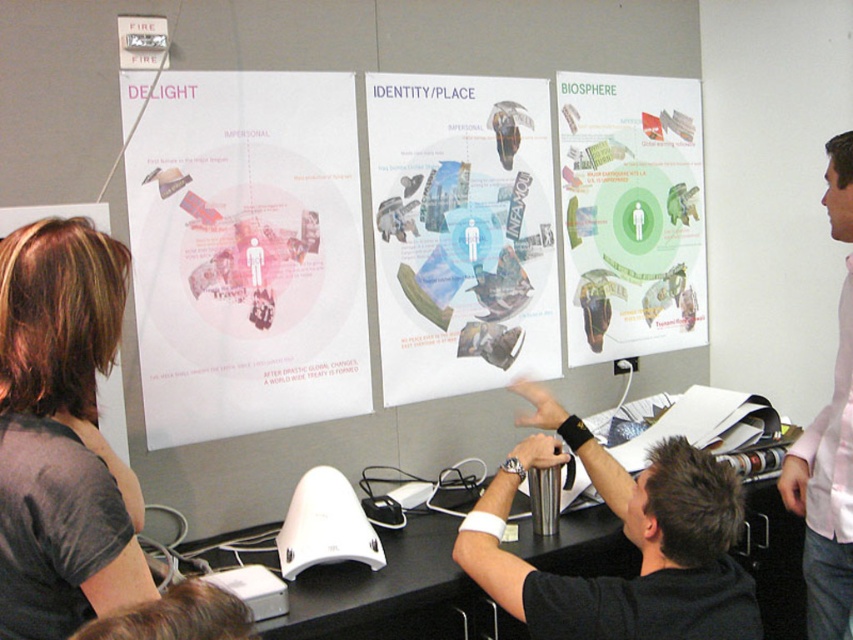
Is point (436, 397) positioned before point (682, 442)?

No.

Does point (550, 333) come farther from viewer compared to point (670, 445)?

Yes, it is.

This screenshot has width=853, height=640. I want to click on matte paper poster at center, so click(461, 232).

Is white paper poster at upper left thinner than pink cotton shirt at right?

No, white paper poster at upper left is not thinner than pink cotton shirt at right.

Between white paper poster at upper left and pink cotton shirt at right, which one is positioned lower?

Positioned lower is pink cotton shirt at right.

The image size is (853, 640). Identify the location of white paper poster at upper left. (245, 252).

Where is `white paper poster at upper left`? The height and width of the screenshot is (640, 853). white paper poster at upper left is located at coordinates (245, 252).

Does point (602, 572) lie behind point (27, 205)?

Yes, it is.

In the scene shown: Is black glossy table at center further to the viewer compared to shiny brown hair at upper left?

No.

Is point (575, 541) farther from camera compared to point (22, 218)?

Yes, it is.

Where is `black glossy table at center`? The height and width of the screenshot is (640, 853). black glossy table at center is located at coordinates (393, 595).